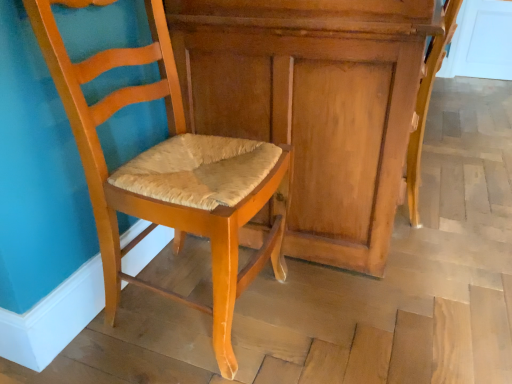
Question: From the image's perspective, is wooden dresser at center located above light brown wood chair at lower right, which is the second chair in left-to-right order?

Choices:
 (A) no
 (B) yes

Answer: (B)

Question: Does wooden dresser at center have a greater width compared to light brown wood chair at lower right, which is the second chair in left-to-right order?

Choices:
 (A) yes
 (B) no

Answer: (A)

Question: Is wooden dresser at center bigger than light brown wood chair at lower right, arranged as the first chair when viewed from the right?

Choices:
 (A) yes
 (B) no

Answer: (A)

Question: From a real-world perspective, is wooden dresser at center on light brown wood chair at lower right, arranged as the first chair when viewed from the right?

Choices:
 (A) no
 (B) yes

Answer: (B)

Question: Is the depth of wooden dresser at center greater than that of light brown wood chair at lower right, arranged as the first chair when viewed from the right?

Choices:
 (A) yes
 (B) no

Answer: (B)

Question: Does wooden dresser at center have a lesser width compared to light brown wood chair at lower right, arranged as the first chair when viewed from the right?

Choices:
 (A) no
 (B) yes

Answer: (A)

Question: Is matte wood chair at center, the second chair viewed from the right, a part of light brown wood chair at lower right, which is the second chair in left-to-right order?

Choices:
 (A) yes
 (B) no

Answer: (B)

Question: Are light brown wood chair at lower right, which is the second chair in left-to-right order, and matte wood chair at center, the second chair viewed from the right, located far from each other?

Choices:
 (A) no
 (B) yes

Answer: (A)

Question: Is light brown wood chair at lower right, which is the second chair in left-to-right order, shorter than matte wood chair at center, placed as the 1th chair when sorted from left to right?

Choices:
 (A) no
 (B) yes

Answer: (B)

Question: Considering the relative sizes of light brown wood chair at lower right, arranged as the first chair when viewed from the right, and matte wood chair at center, the second chair viewed from the right, in the image provided, is light brown wood chair at lower right, arranged as the first chair when viewed from the right, wider than matte wood chair at center, the second chair viewed from the right,?

Choices:
 (A) yes
 (B) no

Answer: (B)

Question: Could you tell me if light brown wood chair at lower right, which is the second chair in left-to-right order, is turned towards matte wood chair at center, the second chair viewed from the right?

Choices:
 (A) no
 (B) yes

Answer: (A)

Question: Is light brown wood chair at lower right, arranged as the first chair when viewed from the right, in contact with matte wood chair at center, the second chair viewed from the right?

Choices:
 (A) no
 (B) yes

Answer: (A)

Question: Considering the relative sizes of matte wood chair at center, the second chair viewed from the right, and wooden dresser at center in the image provided, is matte wood chair at center, the second chair viewed from the right, wider than wooden dresser at center?

Choices:
 (A) no
 (B) yes

Answer: (A)